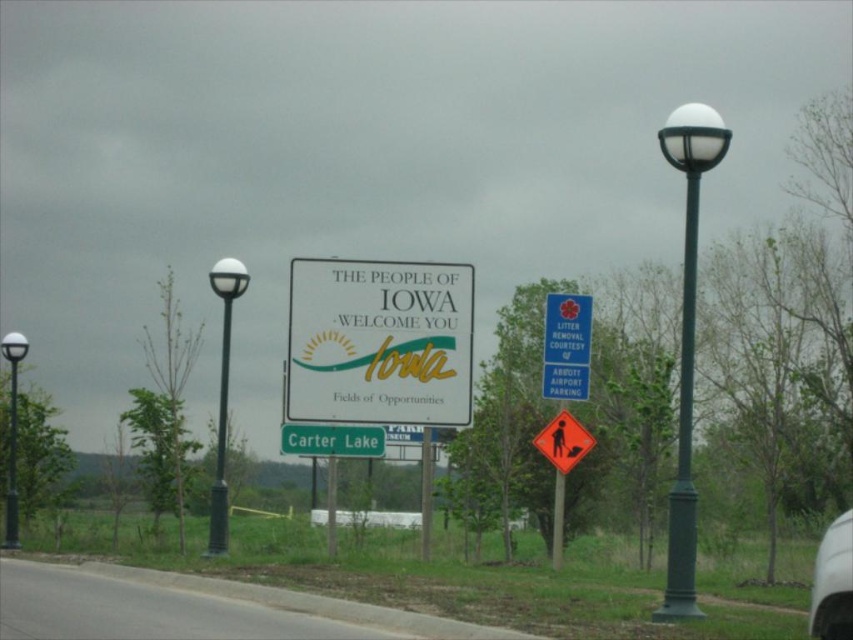
Is matte black lamp post at left shorter than brushed metal pole at center?

Incorrect, matte black lamp post at left's height does not fall short of brushed metal pole at center's.

Does point (222, 504) lie in front of point (426, 525)?

Yes.

I want to click on matte black lamp post at left, so click(x=223, y=394).

Describe the element at coordinates (688, 342) in the screenshot. The image size is (853, 640). I see `green matte lamp post at right` at that location.

Is green matte lamp post at right behind green painted metal pole at center?

No, it is in front of green painted metal pole at center.

The width and height of the screenshot is (853, 640). What are the coordinates of `green matte lamp post at right` in the screenshot? It's located at (688, 342).

Which is below, blue plastic sign at center right or white glossy car at lower right?

white glossy car at lower right is lower down.

Is point (575, 308) closer to camera compared to point (822, 632)?

That is False.

Which is in front, point (544, 348) or point (842, 582)?

Point (842, 582)

You are a GUI agent. You are given a task and a screenshot of the screen. Output one action in this format:
    pyautogui.click(x=<x>, y=<y>)
    Task: Click on the blue plastic sign at center right
    
    Given the screenshot: What is the action you would take?
    pyautogui.click(x=566, y=346)